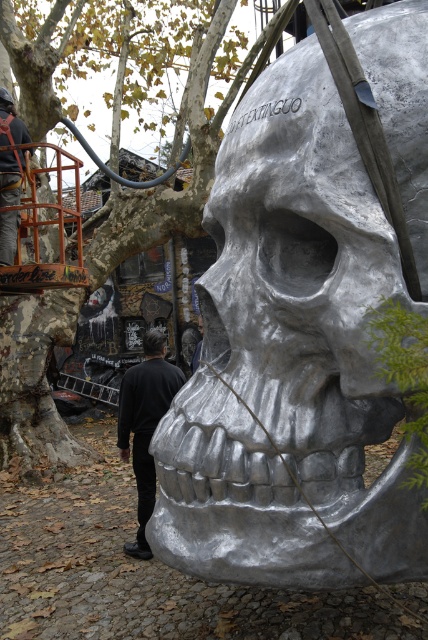
Does shiny silver skull at center lie in front of smooth bark tree at center?

Yes, it is.

Does shiny silver skull at center have a greater width compared to smooth bark tree at center?

Yes.

What do you see at coordinates (288, 358) in the screenshot? Image resolution: width=428 pixels, height=640 pixels. I see `shiny silver skull at center` at bounding box center [288, 358].

The width and height of the screenshot is (428, 640). Find the location of `shiny silver skull at center`. shiny silver skull at center is located at coordinates (288, 358).

Is shiny silver skull at center wider than black matte clothing at lower center?

Correct, the width of shiny silver skull at center exceeds that of black matte clothing at lower center.

Who is lower down, shiny silver skull at center or black matte clothing at lower center?

black matte clothing at lower center is below.

Which is behind, point (344, 365) or point (152, 404)?

The point (152, 404) is behind.

This screenshot has height=640, width=428. I want to click on shiny silver skull at center, so (288, 358).

Between point (83, 444) and point (160, 372), which one is positioned in front?

Point (160, 372) is in front.

Describe the element at coordinates (103, 275) in the screenshot. This screenshot has width=428, height=640. I see `smooth bark tree at center` at that location.

The height and width of the screenshot is (640, 428). I want to click on smooth bark tree at center, so click(x=103, y=275).